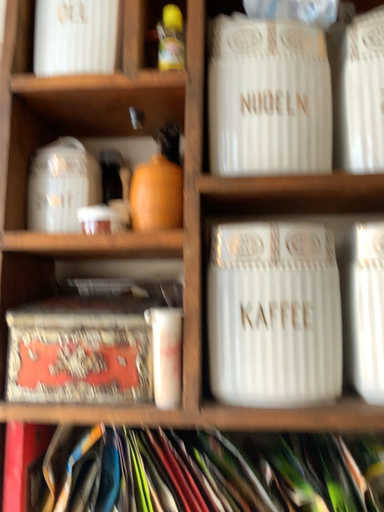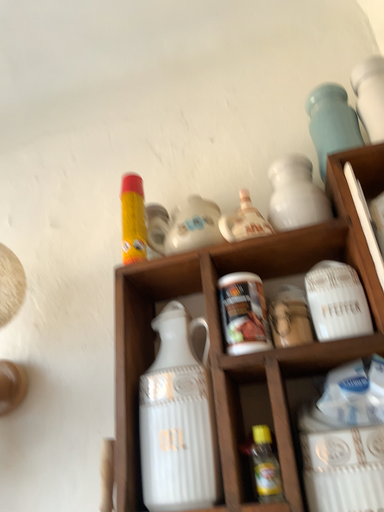
Question: Which way did the camera rotate in the video?

Choices:
 (A) rotated upward
 (B) rotated downward

Answer: (A)